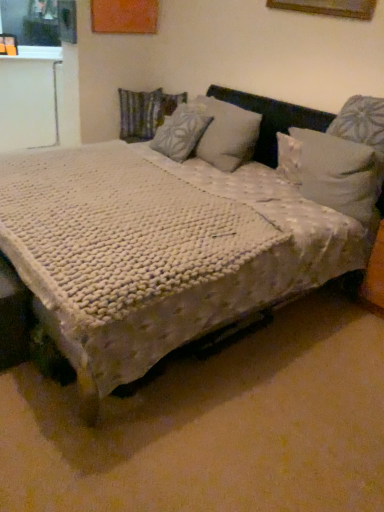
The image size is (384, 512). Describe the element at coordinates (237, 266) in the screenshot. I see `white textured blanket at center` at that location.

What do you see at coordinates (145, 112) in the screenshot? Image resolution: width=384 pixels, height=512 pixels. I see `textured fabric pillow at center, which is the 1th pillow in back-to-front order` at bounding box center [145, 112].

This screenshot has width=384, height=512. What do you see at coordinates (331, 170) in the screenshot?
I see `white soft pillow at upper right, which appears as the 1th pillow when viewed from the front` at bounding box center [331, 170].

You are a GUI agent. You are given a task and a screenshot of the screen. Output one action in this format:
    pyautogui.click(x=<x>, y=<y>)
    Task: Click on the white textured pillow at center, acting as the 2th pillow starting from the right
    The image size is (384, 512).
    Given the screenshot: What is the action you would take?
    pyautogui.click(x=181, y=131)

I want to click on white textured blanket at center, so click(x=237, y=266).

Considering the relative sizes of white textured blanket at center and white textured blanket at center in the image provided, is white textured blanket at center smaller than white textured blanket at center?

Correct, white textured blanket at center occupies less space than white textured blanket at center.

Between white textured blanket at center and white textured blanket at center, which one appears on the left side from the viewer's perspective?

white textured blanket at center.

From the image's perspective, is white textured blanket at center positioned above or below white textured blanket at center?

Clearly, from the image's perspective, white textured blanket at center is below white textured blanket at center.

Considering the positions of objects white textured blanket at center and white textured blanket at center in the image provided, who is behind, white textured blanket at center or white textured blanket at center?

white textured blanket at center is behind.

The image size is (384, 512). I want to click on pillow on the left of the white textured blanket at center, so click(x=145, y=112).

Does textured fabric pillow at center, which is the 1th pillow from left to right, have a larger size compared to white textured blanket at center?

No, textured fabric pillow at center, which is the 1th pillow from left to right, is not bigger than white textured blanket at center.

Based on the photo, from the image's perspective, which is below, textured fabric pillow at center, which is the 1th pillow from left to right, or white textured blanket at center?

white textured blanket at center appears lower in the image.

Is point (139, 111) positioned in front of point (281, 224)?

No, (139, 111) is further to viewer.

Is white textured blanket at center spatially inside white soft pillow at upper right, placed as the 1th pillow when sorted from right to left, or outside of it?

white textured blanket at center is not inside white soft pillow at upper right, placed as the 1th pillow when sorted from right to left, it's outside.

In order to click on bed below the white soft pillow at upper right, which ranks as the third pillow in left-to-right order (from the image's perspective) in this screenshot , I will do `click(237, 266)`.

Which of these two, white textured blanket at center or white soft pillow at upper right, placed as the 3th pillow when sorted from back to front, is thinner?

With smaller width is white soft pillow at upper right, placed as the 3th pillow when sorted from back to front.

From the image's perspective, which object appears higher, white textured blanket at center or white soft pillow at upper right, which appears as the 1th pillow when viewed from the front?

white soft pillow at upper right, which appears as the 1th pillow when viewed from the front, appears higher in the image.

From a real-world perspective, is textured fabric pillow at center, which is the 1th pillow in back-to-front order, located higher than white soft pillow at upper right, which appears as the 1th pillow when viewed from the front?

Result: No.

Based on the photo, would you consider textured fabric pillow at center, which is the 1th pillow in back-to-front order, to be distant from white soft pillow at upper right, placed as the 1th pillow when sorted from right to left?

Yes, textured fabric pillow at center, which is the 1th pillow in back-to-front order, and white soft pillow at upper right, placed as the 1th pillow when sorted from right to left, are located far from each other.

Is textured fabric pillow at center, the third pillow in the front-to-back sequence, oriented towards white soft pillow at upper right, which ranks as the third pillow in left-to-right order?

No.

Is textured fabric pillow at center, which is the 1th pillow from left to right, outside of white soft pillow at upper right, placed as the 1th pillow when sorted from right to left?

Yes.

Can you confirm if white textured blanket at center is taller than white textured pillow at center, placed as the second pillow when sorted from back to front?

Indeed, white textured blanket at center has a greater height compared to white textured pillow at center, placed as the second pillow when sorted from back to front.

Where is `the 3rd pillow directly above the white textured blanket at center (from a real-world perspective)`? The width and height of the screenshot is (384, 512). the 3rd pillow directly above the white textured blanket at center (from a real-world perspective) is located at coordinates (181, 131).

From a real-world perspective, is white textured blanket at center above or below white textured pillow at center, acting as the 2th pillow starting from the right?

white textured blanket at center is situated lower than white textured pillow at center, acting as the 2th pillow starting from the right, in the real world.

From the image's perspective, is white textured blanket at center above or below white textured pillow at center, the second pillow viewed from the left?

white textured blanket at center is situated lower than white textured pillow at center, the second pillow viewed from the left, in the image.

Considering the positions of objects white soft pillow at upper right, which ranks as the third pillow in left-to-right order, and white textured blanket at center in the image provided, who is behind, white soft pillow at upper right, which ranks as the third pillow in left-to-right order, or white textured blanket at center?

white soft pillow at upper right, which ranks as the third pillow in left-to-right order.

Is white textured blanket at center a part of white soft pillow at upper right, which appears as the 1th pillow when viewed from the front?

No, white textured blanket at center is not inside white soft pillow at upper right, which appears as the 1th pillow when viewed from the front.

Looking at their sizes, would you say white soft pillow at upper right, which ranks as the third pillow in left-to-right order, is wider or thinner than white textured blanket at center?

white soft pillow at upper right, which ranks as the third pillow in left-to-right order, is thinner than white textured blanket at center.

Could you tell me if white soft pillow at upper right, which ranks as the third pillow in left-to-right order, is facing white textured blanket at center?

Yes, white soft pillow at upper right, which ranks as the third pillow in left-to-right order, is facing white textured blanket at center.

From a real-world perspective, which object stands above the other?

textured fabric pillow at center, which is the 1th pillow from left to right, is physically above.

Who is shorter, textured fabric pillow at center, which appears as the third pillow when viewed from the right, or white textured blanket at center?

With less height is white textured blanket at center.

Which object is wider, textured fabric pillow at center, which appears as the third pillow when viewed from the right, or white textured blanket at center?

white textured blanket at center.

From the image's perspective, is textured fabric pillow at center, which appears as the third pillow when viewed from the right, above white textured blanket at center?

Yes, from the image's perspective, textured fabric pillow at center, which appears as the third pillow when viewed from the right, is on top of white textured blanket at center.

The width and height of the screenshot is (384, 512). I want to click on sheet below the white textured blanket at center (from a real-world perspective), so click(x=118, y=231).

From a real-world perspective, count 1st pillows upward from the white textured blanket at center and point to it. Please provide its 2D coordinates.

[(145, 112)]

From the image, which object appears to be farther from white textured blanket at center, white soft pillow at upper right, which ranks as the third pillow in left-to-right order, or textured fabric pillow at center, which is the 1th pillow in back-to-front order?

The object further to white textured blanket at center is textured fabric pillow at center, which is the 1th pillow in back-to-front order.

From the image, which object appears to be farther from white textured blanket at center, textured fabric pillow at center, which is the 1th pillow from left to right, or white textured pillow at center, the second pillow viewed from the left?

textured fabric pillow at center, which is the 1th pillow from left to right.

From the image, which object appears to be farther from textured fabric pillow at center, which is the 1th pillow in back-to-front order, white textured blanket at center or white textured blanket at center?

→ white textured blanket at center is positioned further to the anchor textured fabric pillow at center, which is the 1th pillow in back-to-front order.

Considering their positions, is white textured blanket at center positioned further to white soft pillow at upper right, placed as the 1th pillow when sorted from right to left, than white textured pillow at center, the 2th pillow positioned from the front?

white textured blanket at center is positioned further to the anchor white soft pillow at upper right, placed as the 1th pillow when sorted from right to left.

When comparing their distances from white textured blanket at center, does textured fabric pillow at center, which is the 1th pillow from left to right, or white soft pillow at upper right, placed as the 3th pillow when sorted from back to front, seem closer?

The object closer to white textured blanket at center is white soft pillow at upper right, placed as the 3th pillow when sorted from back to front.

When comparing their distances from white soft pillow at upper right, which ranks as the third pillow in left-to-right order, does textured fabric pillow at center, which is the 1th pillow from left to right, or white textured blanket at center seem closer?

Among the two, white textured blanket at center is located nearer to white soft pillow at upper right, which ranks as the third pillow in left-to-right order.

Considering their positions, is white soft pillow at upper right, which appears as the 1th pillow when viewed from the front, positioned closer to textured fabric pillow at center, the third pillow in the front-to-back sequence, than white textured blanket at center?

white soft pillow at upper right, which appears as the 1th pillow when viewed from the front.

Estimate the real-world distances between objects in this image. Which object is closer to white textured blanket at center, textured fabric pillow at center, which is the 1th pillow from left to right, or white textured blanket at center?

white textured blanket at center is positioned closer to the anchor white textured blanket at center.

The height and width of the screenshot is (512, 384). Identify the location of bed between white textured blanket at center and white soft pillow at upper right, placed as the 3th pillow when sorted from back to front, in the horizontal direction. (237, 266).

This screenshot has width=384, height=512. Identify the location of sheet between white textured blanket at center and textured fabric pillow at center, the third pillow in the front-to-back sequence, from front to back. (118, 231).

Locate an element on the screen. pillow positioned between white textured blanket at center and white textured pillow at center, placed as the second pillow when sorted from back to front, from near to far is located at coordinates (331, 170).

I want to click on sheet between white textured blanket at center and white textured pillow at center, acting as the 2th pillow starting from the right, from front to back, so click(x=118, y=231).